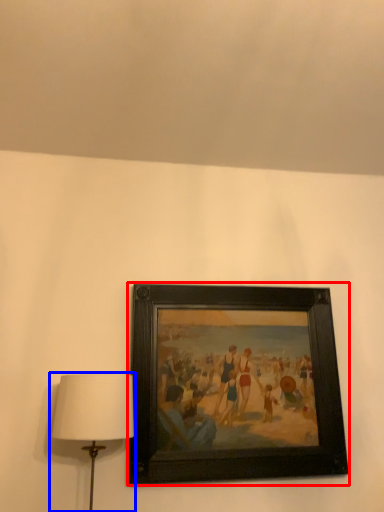
Question: Which of the following is the closest to the observer, picture frame (highlighted by a red box) or lamp (highlighted by a blue box)?

Choices:
 (A) picture frame
 (B) lamp

Answer: (B)